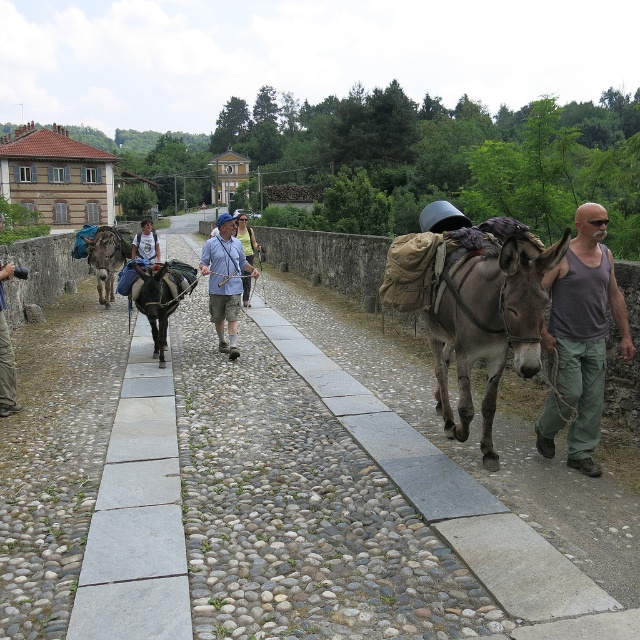
Question: Does gray tank top at right appear under brown leather mule at left?

Choices:
 (A) no
 (B) yes

Answer: (B)

Question: Which point is closer to the camera?

Choices:
 (A) brown leather mule at left
 (B) blue denim shorts at center
 (C) dark brown leather mule at center
 (D) gray tank top at right

Answer: (D)

Question: Based on their relative distances, which object is nearer to the brown leather mule at left?

Choices:
 (A) gray tank top at right
 (B) gray matte donkey at center
 (C) blue denim shorts at center

Answer: (C)

Question: Which of the following is the closest to the observer?

Choices:
 (A) dark brown leather mule at center
 (B) brown leather mule at left

Answer: (A)

Question: Can you confirm if gray tank top at right is wider than blue denim shorts at center?

Choices:
 (A) no
 (B) yes

Answer: (A)

Question: Is gray matte donkey at center positioned at the back of gray tank top at right?

Choices:
 (A) yes
 (B) no

Answer: (B)